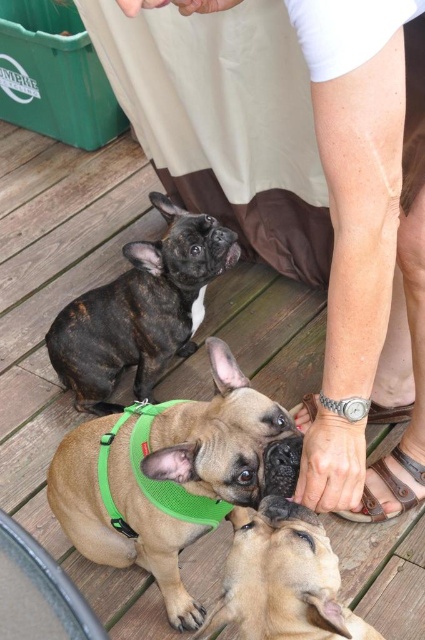
You are a dog owner trying to locate your dog. You see a skinny white leg at upper center and a brown mesh harness at center. Which object is higher in the image?

The skinny white leg at upper center is higher than the brown mesh harness at center.

You are a dog trainer observing the scene. You notice the skinny white leg at upper center and the brown mesh harness at center. Which object is positioned higher in the image?

The skinny white leg at upper center is positioned higher than the brown mesh harness at center in the image.

You are a dog trainer observing the scene. You need to ensure that the green mesh harness at center is visible to all attendees during a demonstration. Given that the brown leather sandal at lower center is in the way, what adjustment should you make to the setup?

Since the green mesh harness at center is taller than the brown leather sandal at lower center, you can move the brown leather sandal at lower center to a position where it does not block the view of the green mesh harness at center.